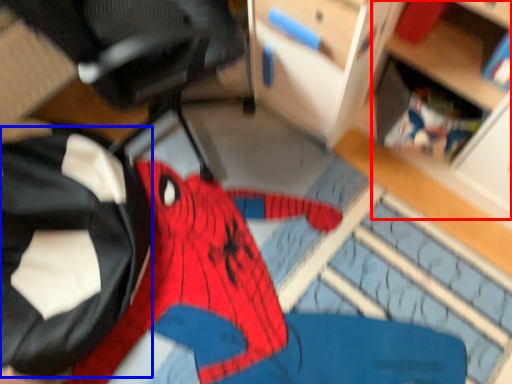
Question: Which of the following is the closest to the observer, shelf (highlighted by a red box) or clothing (highlighted by a blue box)?

Choices:
 (A) shelf
 (B) clothing

Answer: (A)